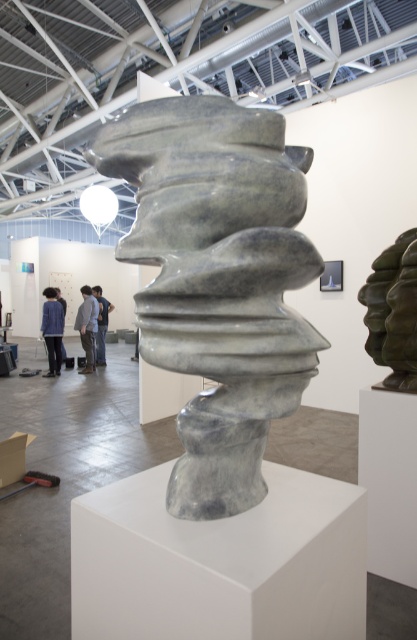
Question: From the image, what is the correct spatial relationship of bronze textured sculpture at right in relation to gray fabric jacket at center?

Choices:
 (A) below
 (B) above

Answer: (B)

Question: Which object is closer to the camera taking this photo?

Choices:
 (A) gray stone sculpture at center
 (B) blue denim jacket at left
 (C) bronze textured sculpture at right

Answer: (A)

Question: Which of the following is the farthest from the observer?

Choices:
 (A) blue jeans at center
 (B) blue denim jacket at left
 (C) blue denim jacket at center
 (D) gray stone sculpture at center

Answer: (A)

Question: Estimate the real-world distances between objects in this image. Which object is farther from the gray stone sculpture at center?

Choices:
 (A) bronze textured sculpture at right
 (B) gray fabric jacket at center

Answer: (B)

Question: Is the position of bronze textured sculpture at right more distant than that of blue denim jacket at left?

Choices:
 (A) no
 (B) yes

Answer: (A)

Question: Does gray stone sculpture at center have a smaller size compared to gray fabric jacket at center?

Choices:
 (A) yes
 (B) no

Answer: (A)